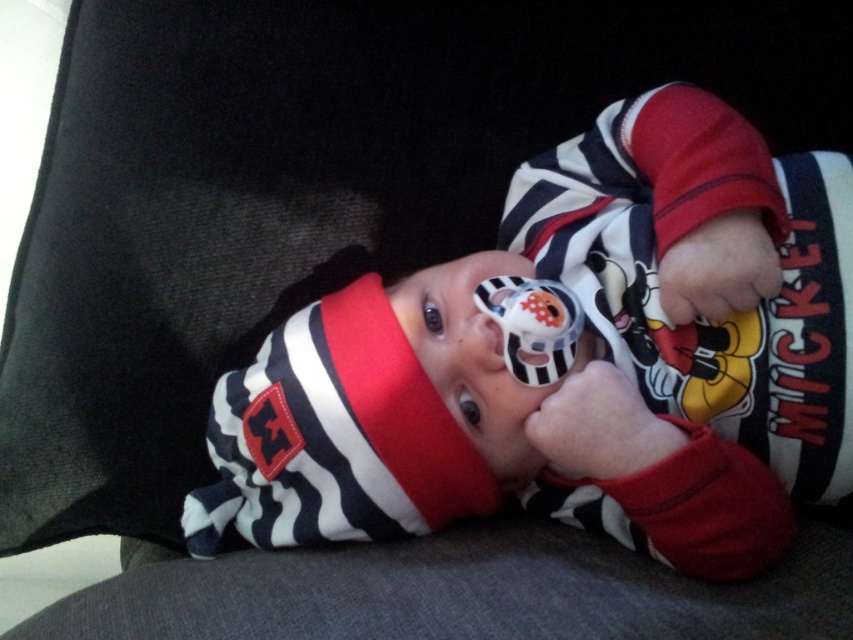
You are a parent holding the striped fabric baby at center and the matte plastic pacifier at center. Which object is bigger?

The striped fabric baby at center is larger in size compared to the matte plastic pacifier at center.

You are a photographer standing at a certain distance from the striped fabric baby at center. You want to take a closeup shot of the baby without using a zoom lens. What is the minimum distance you need to move closer to the baby to achieve this?

The striped fabric baby at center and camera are 31.92 inches apart from each other. To take a closeup shot without a zoom lens, you would need to move closer to the baby until you reach the minimum focusing distance required by your camera lens. However, the current distance is 31.92 inches, so you must move closer than that distance to get the closeup.